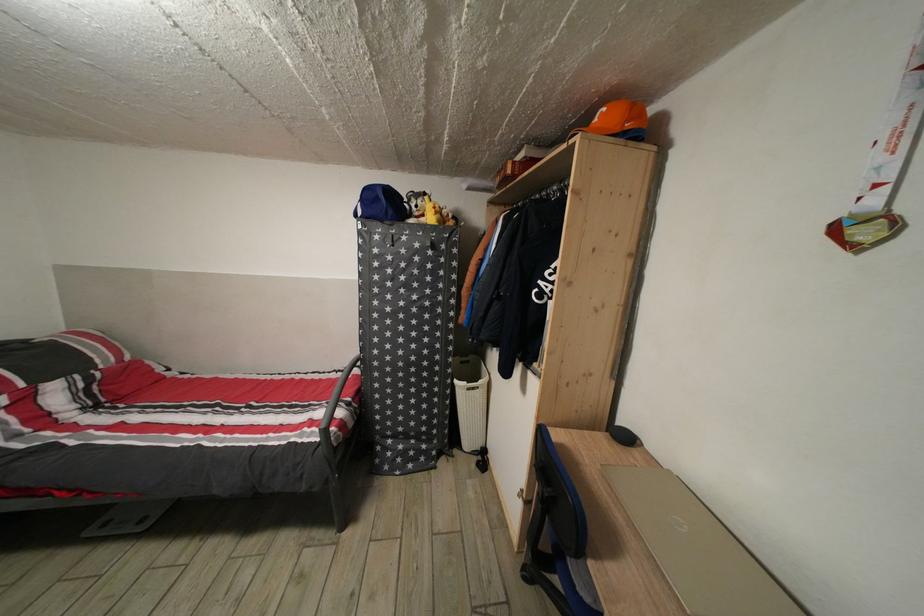
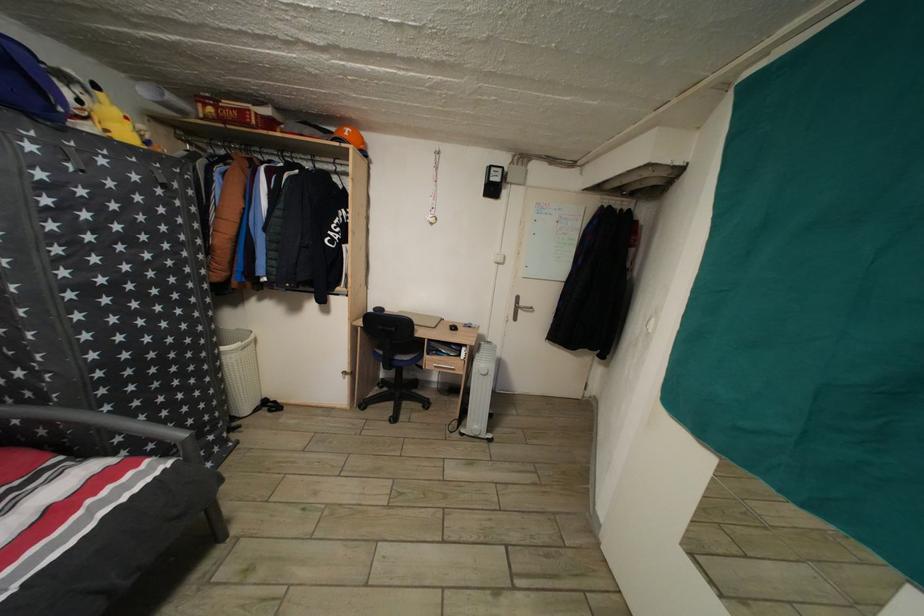
The point at (311, 436) is marked in the first image. Where is the corresponding point in the second image?

(96, 508)